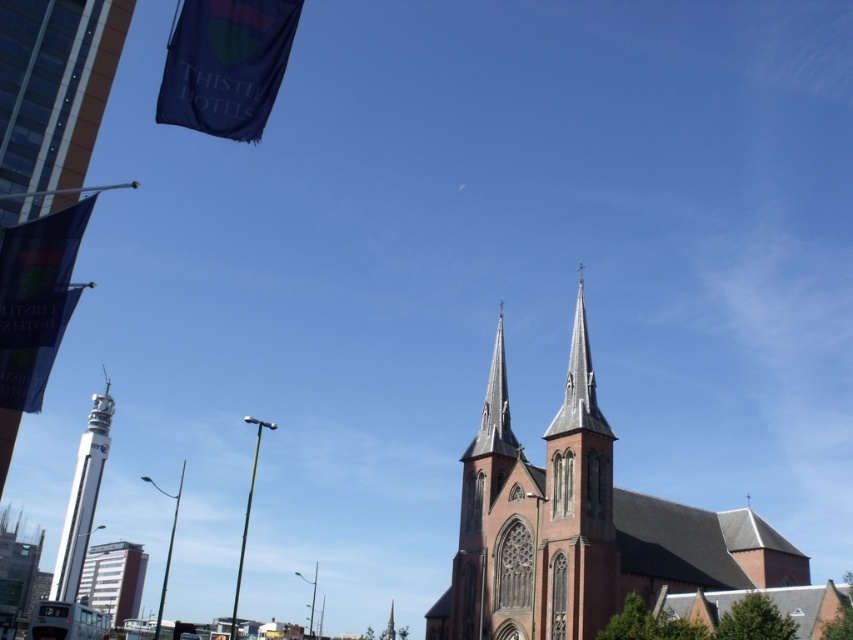
You are standing at the center of the image and want to take a photo of both the red brick tower at lower left and the metallic silver bus at lower left. Which object should you zoom in on to ensure both are in the frame?

You should zoom in on the metallic silver bus at lower left because it is closer to you than the red brick tower at lower left, so zooming in on it will help include both in the frame.

Looking at this image, you are a city planner evaluating the spacing between the red brick church at center and the metallic silver bus at lower left. According to the city regulations, the minimum required distance between any historical building and a public transport vehicle is 50 meters. Does the current distance meet the regulation?

Result: The red brick church at center and metallic silver bus at lower left are 56.34 meters apart from each other, which exceeds the 50 meters minimum requirement. Therefore, the current distance meets the regulation.

You are standing at the point marked by the coordinates point (113, 579) in the image. What object are you directly in front of?

The point (113, 579) corresponds to the red brick tower at lower left, so you are directly in front of the red brick tower at lower left.